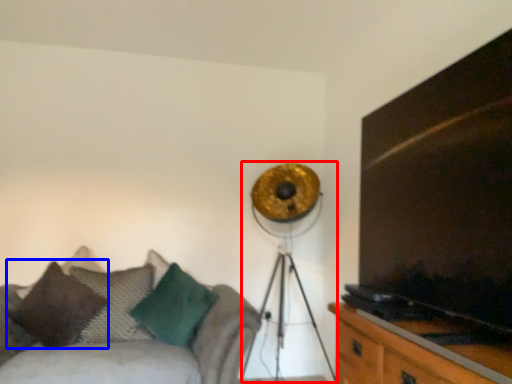
Question: Which object is closer to the camera taking this photo, lamp (highlighted by a red box) or pillow (highlighted by a blue box)?

Choices:
 (A) lamp
 (B) pillow

Answer: (A)